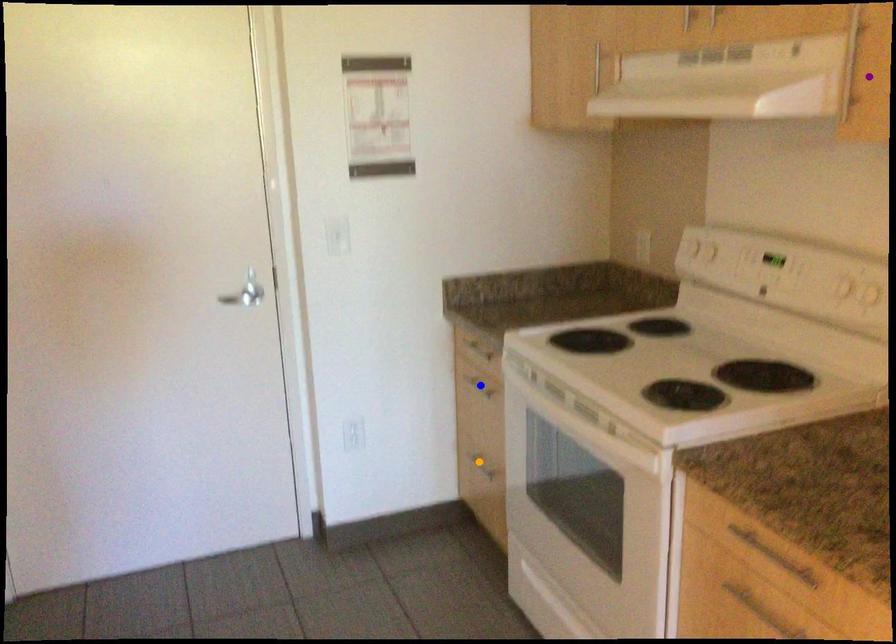
Order these from farthest to nearest:
A) orange point
B) blue point
C) purple point

1. orange point
2. blue point
3. purple point